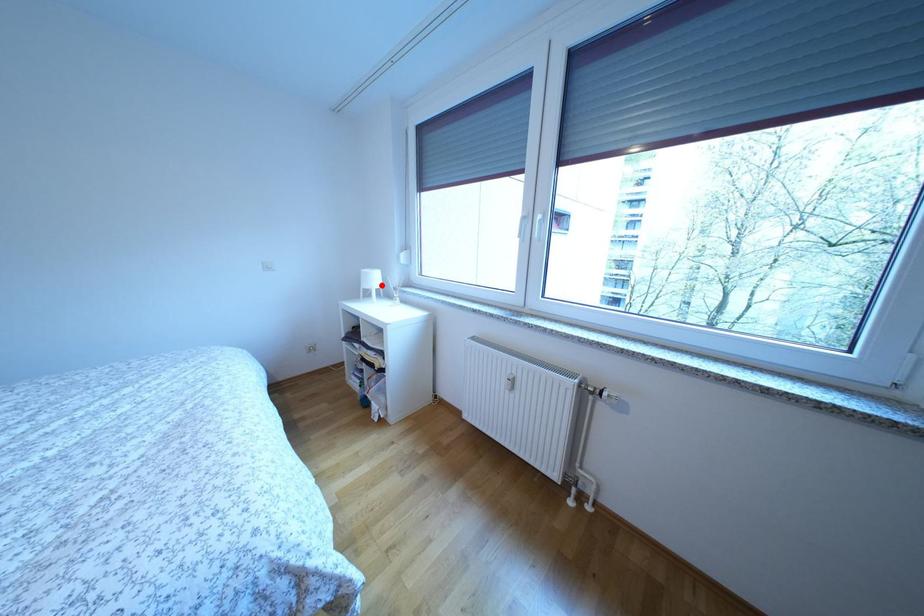
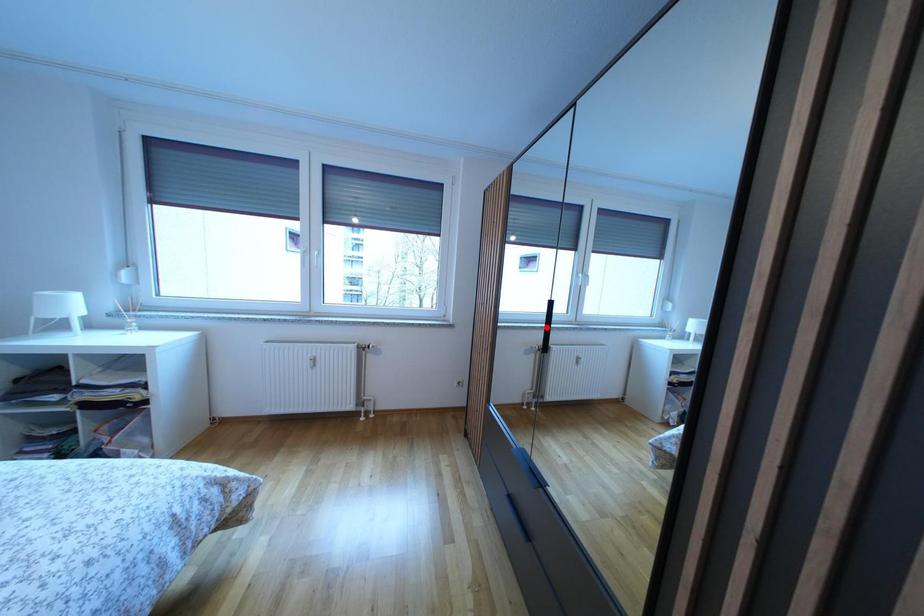
I am providing you with two images of the same scene from different viewpoints. A red point is marked on the first image and another point is marked on the second image. Is the marked point in image1 the same physical position as the marked point in image2?

No